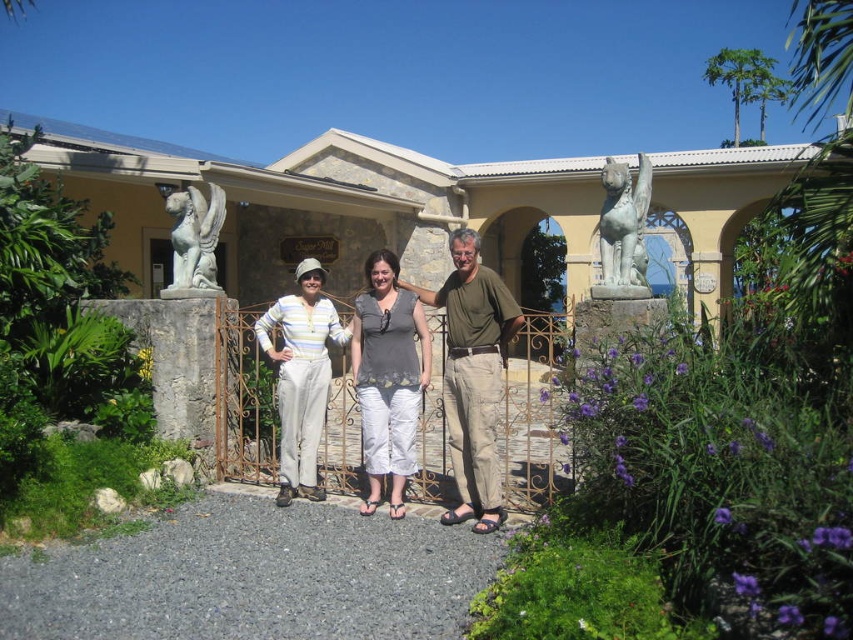
You are a photographer setting up for a group photo at the classical building with arches. You need to ensure that the purple matte flowers at center and the white striped pants at center are both visible in the shot. Based on their heights, which object should you adjust your camera angle to focus on first?

The purple matte flowers at center is shorter than white striped pants at center, so you should focus on the purple matte flowers at center first to ensure they are in frame before adjusting for the taller white striped pants at center.

You are a photographer setting up a shot for the three people in front of the classical building. You want to ensure that the purple matte flowers at center and the white striped pants at center are both in focus. Given that your camera has a depth of field that can cover 6 feet, will both objects be in focus?

The purple matte flowers at center and white striped pants at center are 6.38 feet apart. Since the distance between them exceeds the camera depth of field of 6 feet, they cannot both be in focus simultaneously.

You are a photographer setting up a shot for the three people in front of the classical building. You need to ensure that the purple matte flowers at center and the white striped pants at center are both visible in the frame. Based on their sizes, which object should you prioritize keeping in the frame if you have to adjust the camera angle slightly?

The purple matte flowers at center is smaller in width than the white striped pants at center, so you should prioritize keeping the white striped pants at center in the frame since it is larger and more likely to remain visible even with slight adjustments.